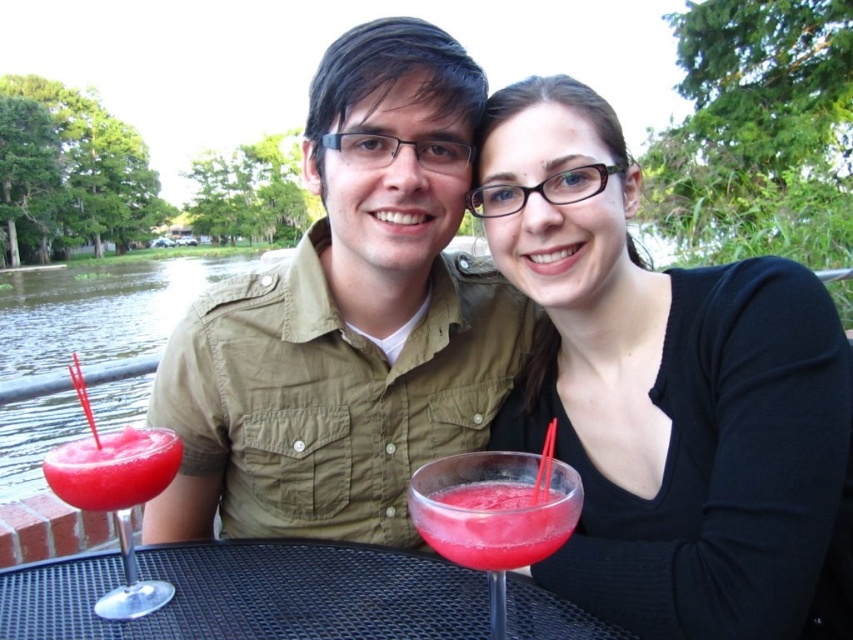
Does matte khaki shirt at center come in front of translucent glass drink at center?

No, it is behind translucent glass drink at center.

At what (x,y) coordinates should I click in order to perform the action: click on matte khaki shirt at center. Please return your answer as a coordinate pair (x, y). The width and height of the screenshot is (853, 640). Looking at the image, I should click on (347, 317).

Identify the location of matte khaki shirt at center. (347, 317).

Can you confirm if matte black shirt at center is bigger than matte khaki shirt at center?

Incorrect, matte black shirt at center is not larger than matte khaki shirt at center.

Does matte black shirt at center appear over matte khaki shirt at center?

Actually, matte black shirt at center is below matte khaki shirt at center.

Which is in front, point (622, 589) or point (247, 291)?

Point (622, 589) is in front.

Identify the location of matte black shirt at center. The height and width of the screenshot is (640, 853). (666, 392).

Based on the photo, does translucent glass drink at center have a smaller size compared to translucent pink drink at center?

No.

This screenshot has height=640, width=853. I want to click on translucent glass drink at center, so click(494, 515).